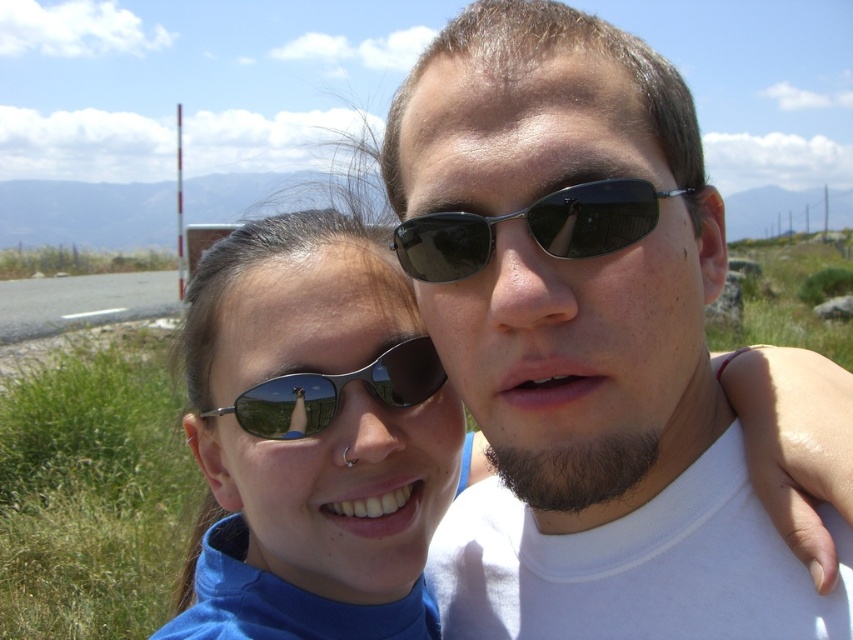
You are taking a photo of two people in the scene. The matte black sunglasses at left and the black plastic sunglasses at center are both visible. Which sunglasses are positioned lower in the image?

The matte black sunglasses at left are positioned lower in the image than the black plastic sunglasses at center.

You are a photographer trying to capture a close detail shot of the sunglasses in the image. You have a lens that can focus on objects up to 10 cm wide. The matte black sunglasses at center and the matte black sunglasses at left are both in your frame. Which pair of sunglasses will your lens be able to focus on?

The matte black sunglasses at center has a lesser width compared to the matte black sunglasses at left. Since the lens can focus on objects up to 10 cm wide, the matte black sunglasses at center will fit within the focus range, but the matte black sunglasses at left might exceed it if its width is over 10 cm. However, without exact measurements, we can only confirm the center pair is smaller. The answer should state that the center pair is narrower, so it can be focused on, while the left pair may be too.